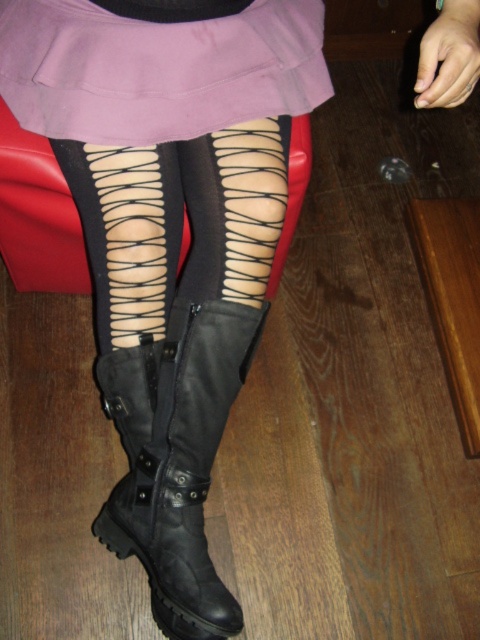
You are a fashion designer analyzing the outfit. You need to determine the spatial relationship between the matte purple skirt at upper center and the black leather boot at lower center. Which object is positioned higher in the image?

The matte purple skirt at upper center is positioned higher in the image than the black leather boot at lower center.

You are standing in front of the scene and want to place a small object exactly where the black leather boots at lower center are located. According to the coordinates provided, where should you place it?

You should place the small object at the coordinates point (169, 234) where the black leather boots at lower center are located.